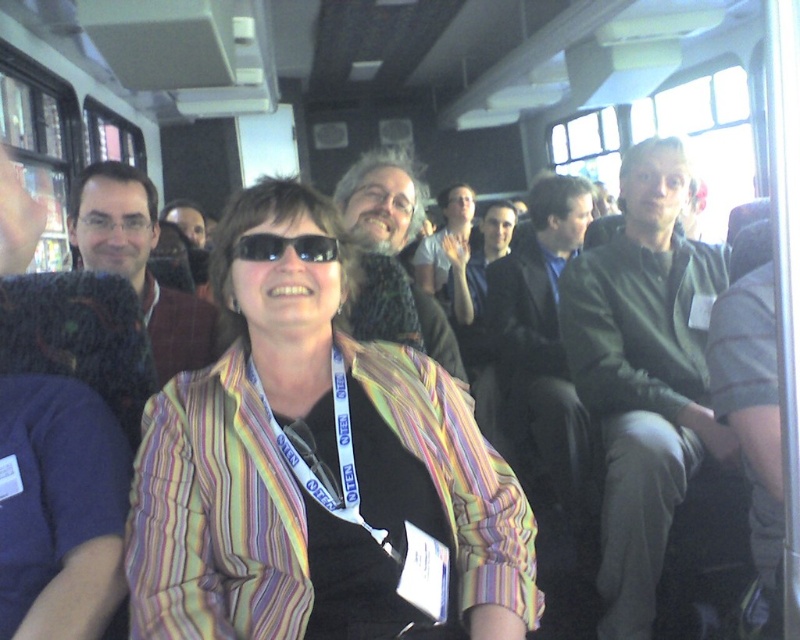
You are a photographer trying to capture a candid shot of the green cotton shirt at right and the matte black camera at center in the bus scene. Since you want to ensure both subjects are in frame, can you determine which subject is wider so you can adjust your camera angle accordingly?

The green cotton shirt at right is wider than the matte black camera at center, so you should adjust your camera angle to accommodate its width to ensure both subjects are fully captured in the frame.

You are a photographer trying to capture a candid shot of both the striped fabric jacket at center and the matte brown sweater at left. Since you can only focus on one subject at a time, which one should you aim for first to ensure the other is still in frame?

The striped fabric jacket at center is positioned on the right side of matte brown sweater at left. Since the photographer can focus on the matte brown sweater at left first, the striped fabric jacket at center will remain in frame to the right, allowing both subjects to be captured in sequence without moving the camera.